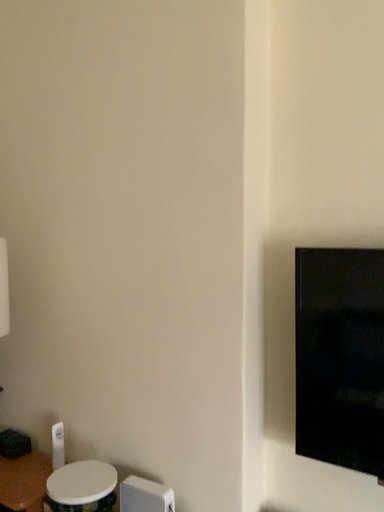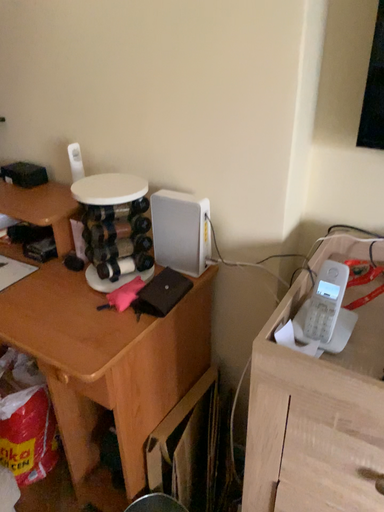
Question: How did the camera likely rotate when shooting the video?

Choices:
 (A) rotated downward
 (B) rotated upward

Answer: (A)